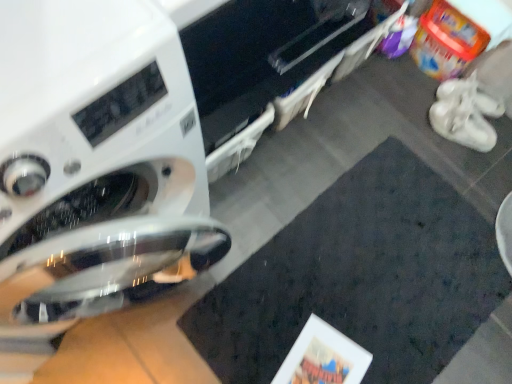
Find the location of `free space underneath white suede sneakers at right (from a real-world perspective)`. free space underneath white suede sneakers at right (from a real-world perspective) is located at coordinates (465, 134).